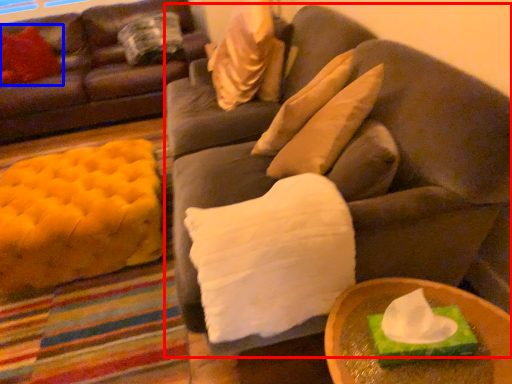
Question: Which point is closer to the camera, studio couch (highlighted by a red box) or pillow (highlighted by a blue box)?

Choices:
 (A) studio couch
 (B) pillow

Answer: (A)